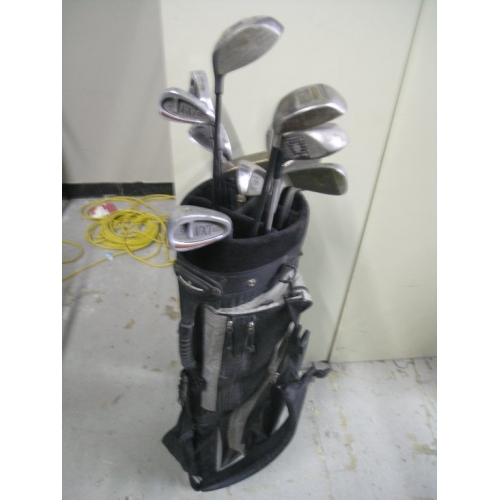
Where is `baseboard`? The height and width of the screenshot is (500, 500). baseboard is located at coordinates (106, 188).